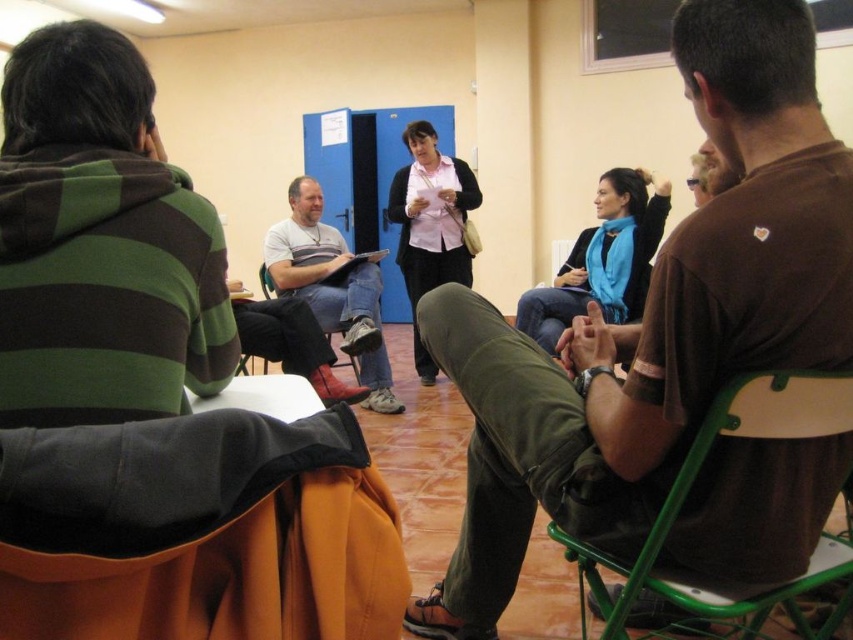
Does brown cotton shirt at center appear on the left side of matte gray shirt at center?

No, brown cotton shirt at center is not to the left of matte gray shirt at center.

What do you see at coordinates (654, 323) in the screenshot? The image size is (853, 640). I see `brown cotton shirt at center` at bounding box center [654, 323].

Image resolution: width=853 pixels, height=640 pixels. Identify the location of brown cotton shirt at center. (654, 323).

Does point (606, 602) lie in front of point (273, 291)?

That is True.

Based on the photo, who is lower down, green plastic chair at lower right or wooden folding chair at center?

green plastic chair at lower right is lower down.

Where is `green plastic chair at lower right`? green plastic chair at lower right is located at coordinates (688, 492).

Identify the location of green plastic chair at lower right. (688, 492).

Is brown cotton shirt at center taller than orange fabric folding chair at lower left?

Indeed, brown cotton shirt at center has a greater height compared to orange fabric folding chair at lower left.

Measure the distance from brown cotton shirt at center to orange fabric folding chair at lower left.

They are 23.52 inches apart.

Find the location of `brown cotton shirt at center`. brown cotton shirt at center is located at coordinates point(654,323).